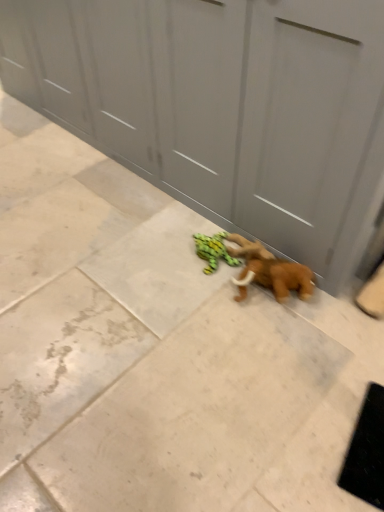
The height and width of the screenshot is (512, 384). I want to click on vacant space that is to the left of brown plush elephant at lower center, so click(x=208, y=302).